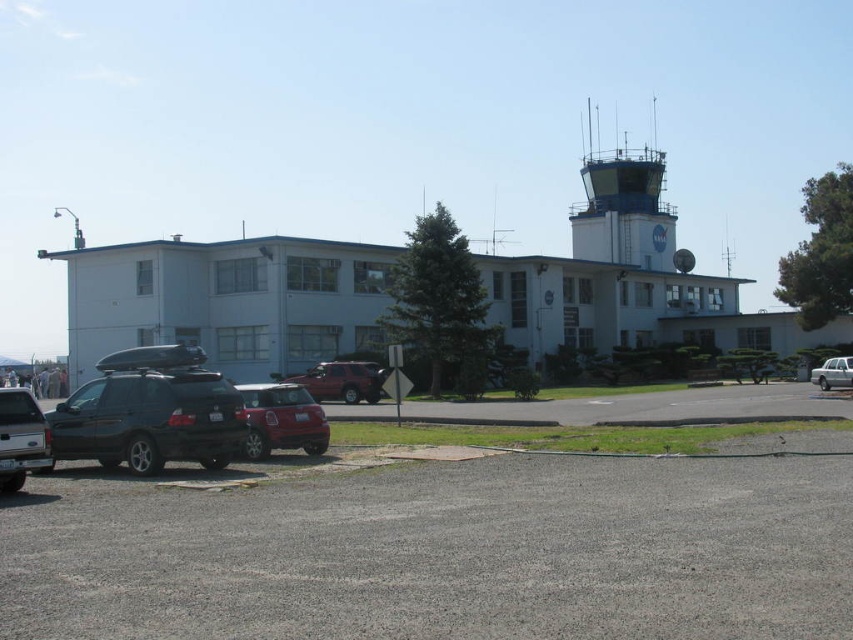
Does smooth gray control tower at upper right have a greater height compared to shiny red car at center?

Indeed, smooth gray control tower at upper right has a greater height compared to shiny red car at center.

Is point (592, 259) positioned behind point (297, 408)?

Yes.

Identify the location of smooth gray control tower at upper right. (624, 209).

Is black matte suv at lower left in front of smooth gray control tower at upper right?

That is True.

Does point (97, 420) lie behind point (630, 243)?

No, (97, 420) is closer to viewer.

You are a GUI agent. You are given a task and a screenshot of the screen. Output one action in this format:
    pyautogui.click(x=<x>, y=<y>)
    Task: Click on the black matte suv at lower left
    This screenshot has width=853, height=640.
    Given the screenshot: What is the action you would take?
    pyautogui.click(x=151, y=412)

Where is `smooth gray control tower at upper right`? smooth gray control tower at upper right is located at coordinates (624, 209).

Can you confirm if smooth gray control tower at upper right is positioned to the right of matte black truck at lower left?

Yes, smooth gray control tower at upper right is to the right of matte black truck at lower left.

Is point (627, 220) in front of point (18, 419)?

No, it is not.

Identify the location of smooth gray control tower at upper right. (624, 209).